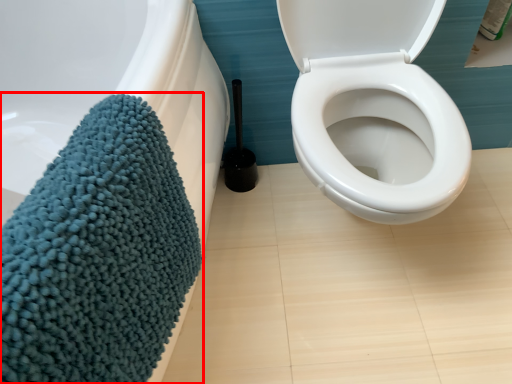
Question: In this image, where is bath towel (annotated by the red box) located relative to brush?

Choices:
 (A) left
 (B) right

Answer: (A)